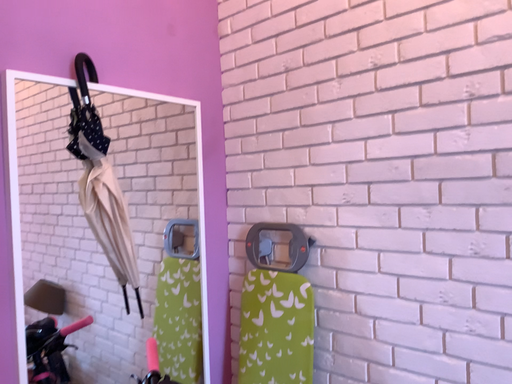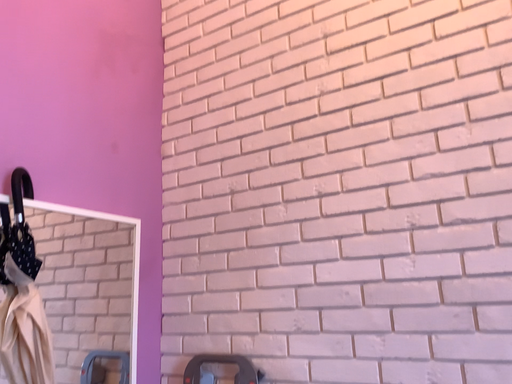
Question: Which way did the camera rotate in the video?

Choices:
 (A) rotated right
 (B) rotated left

Answer: (A)